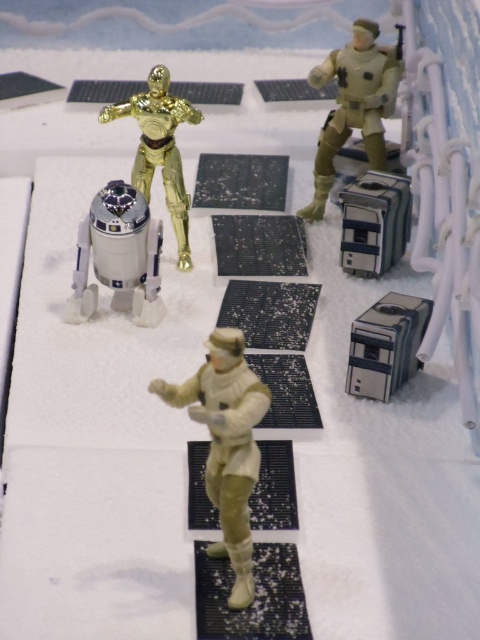
Question: Is white metallic robot at center behind gold metallic figure at upper center?

Choices:
 (A) no
 (B) yes

Answer: (A)

Question: Which is nearer to the tan matte astronaut at upper right?

Choices:
 (A) gold metallic figure at upper center
 (B) metallic gray computer at center

Answer: (A)

Question: Which point is farther to the camera?

Choices:
 (A) metallic gray computer at center
 (B) tan matte astronaut at upper right
 (C) light beige plastic astronaut at center
 (D) white metallic robot at center

Answer: (B)

Question: Which point is closer to the camera?

Choices:
 (A) gold metallic figure at upper center
 (B) white metallic robot at center
 (C) tan matte astronaut at upper right
 (D) metallic gray computer at center

Answer: (D)

Question: Is light beige plastic astronaut at center closer to the viewer compared to metallic silver cube at center?

Choices:
 (A) no
 (B) yes

Answer: (B)

Question: Can you confirm if light beige plastic astronaut at center is positioned to the left of white metallic robot at center?

Choices:
 (A) yes
 (B) no

Answer: (B)